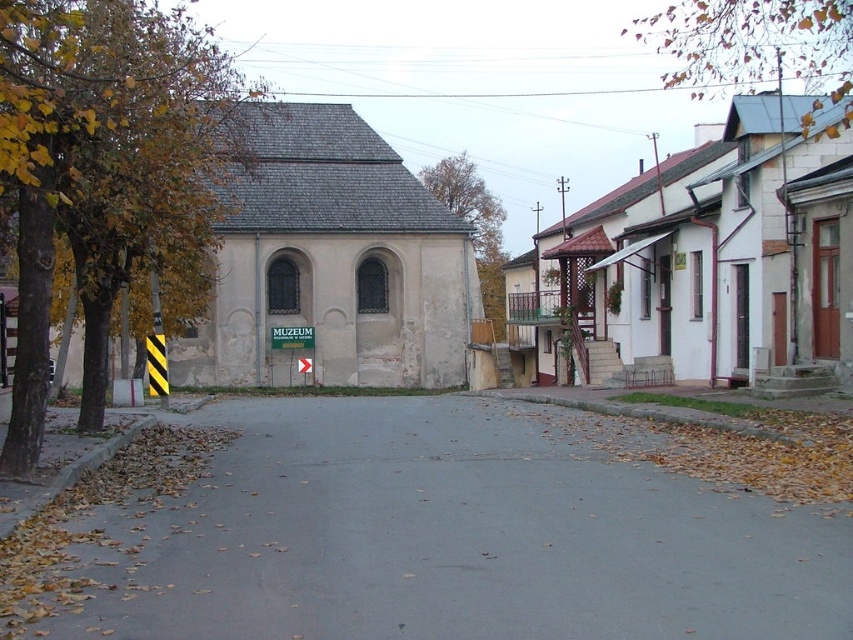
Question: Which point is closer to the camera taking this photo?

Choices:
 (A) (250, 246)
 (B) (306, 376)
 (C) (660, 20)

Answer: (A)

Question: Among these objects, which one is farthest from the camera?

Choices:
 (A) white stone building at right
 (B) green plastic sign at center

Answer: (B)

Question: Which object is closer to the camera taking this photo?

Choices:
 (A) gray asphalt road at center
 (B) green plastic sign at center
 (C) white stone building at right
 (D) gray stone church at center

Answer: (A)

Question: Is brown leafy tree at upper right to the left of green plastic sign at center from the viewer's perspective?

Choices:
 (A) yes
 (B) no

Answer: (B)

Question: Is white stone building at right wider than brown leafy tree at upper right?

Choices:
 (A) no
 (B) yes

Answer: (A)

Question: Is yellow-green foliage at left smaller than green leafy tree at upper center?

Choices:
 (A) no
 (B) yes

Answer: (A)